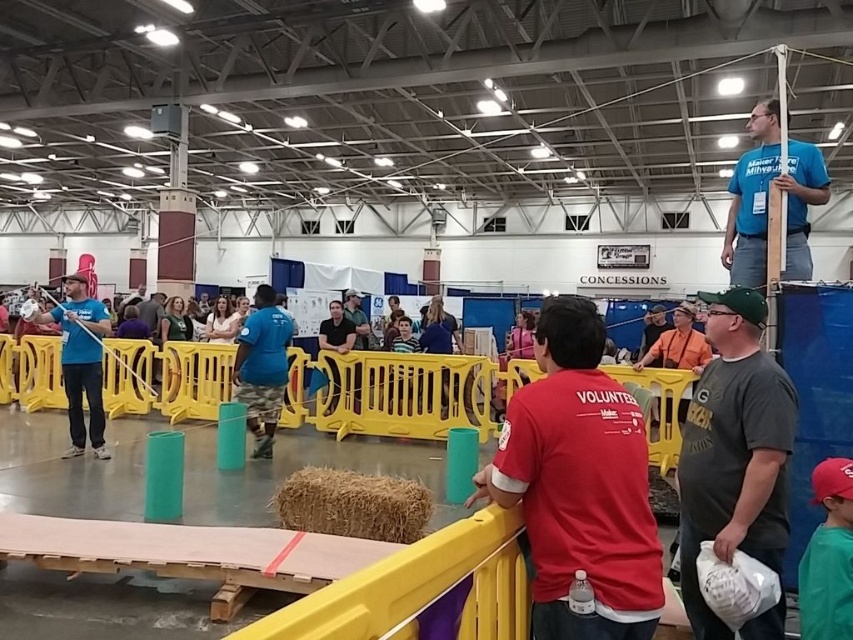
Question: Based on their relative distances, which object is farther from the blue t-shirt at upper right?

Choices:
 (A) green jersey at lower right
 (B) blue t-shirt at center
 (C) blue cotton shirt at center
 (D) matte blue shirt at left

Answer: (D)

Question: Estimate the real-world distances between objects in this image. Which object is closer to the dark gray t-shirt at center-right?

Choices:
 (A) matte blue shirt at left
 (B) orange cotton shirt at upper center
 (C) blue t-shirt at upper right
 (D) blue t-shirt at center

Answer: (C)

Question: Does blue cotton shirt at center have a lesser width compared to blue t-shirt at center?

Choices:
 (A) yes
 (B) no

Answer: (B)

Question: Can you confirm if blue cotton shirt at center is positioned above blue t-shirt at center?

Choices:
 (A) no
 (B) yes

Answer: (A)

Question: Which point is farther from the camera taking this photo?

Choices:
 (A) (67, 394)
 (B) (346, 349)

Answer: (B)

Question: Is blue t-shirt at upper right smaller than blue t-shirt at center?

Choices:
 (A) yes
 (B) no

Answer: (B)